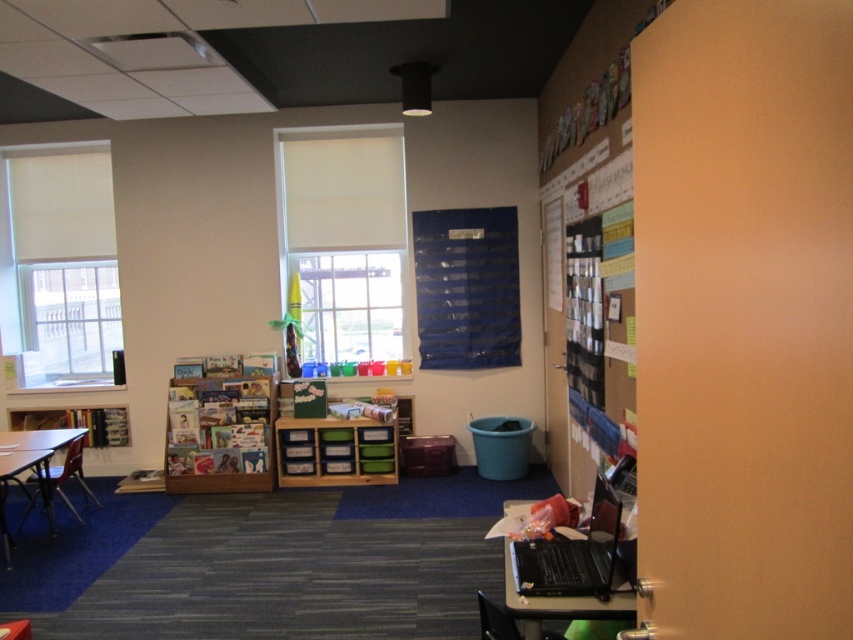
Question: Can you confirm if black plastic computer desk at lower right is positioned to the left of wooden table at left?

Choices:
 (A) no
 (B) yes

Answer: (A)

Question: Which point is closer to the camera?

Choices:
 (A) (234, 401)
 (B) (527, 541)

Answer: (B)

Question: Does wooden table at left appear under black plastic chair at lower right?

Choices:
 (A) no
 (B) yes

Answer: (B)

Question: From the image, what is the correct spatial relationship of black plastic computer desk at lower right in relation to wooden table at left?

Choices:
 (A) below
 (B) above

Answer: (B)

Question: Estimate the real-world distances between objects in this image. Which object is farther from the cardboard bulletin board at right?

Choices:
 (A) black plastic chair at lower right
 (B) wooden table at left
 (C) black plastic computer desk at lower right

Answer: (B)

Question: Among these objects, which one is nearest to the camera?

Choices:
 (A) wooden bookshelf at center
 (B) wooden table at left
 (C) black plastic computer desk at lower right

Answer: (C)